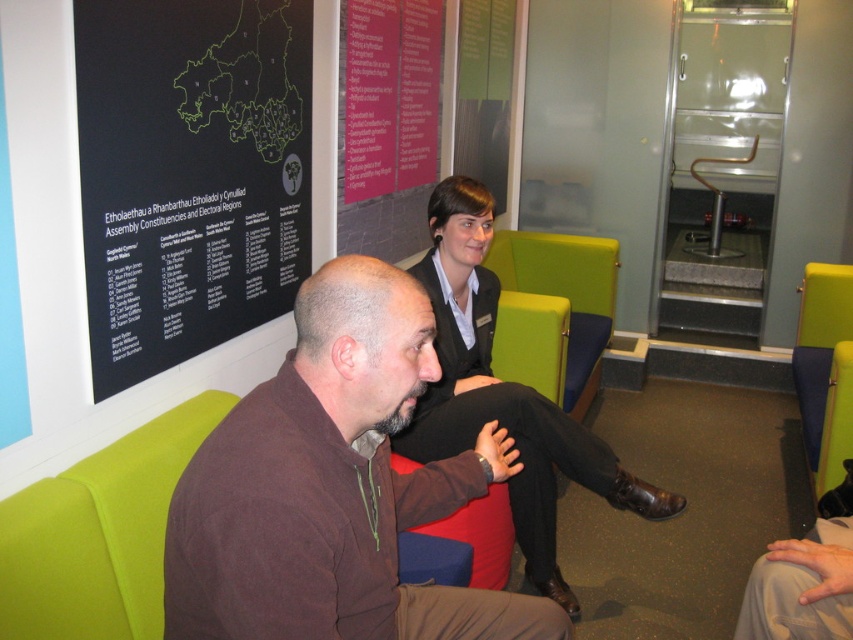
Question: Which object is farther from the camera taking this photo?

Choices:
 (A) black matte/blackboard at upper left
 (B) green fabric armchair at lower right

Answer: (B)

Question: Does brown cotton shirt at center appear over black matte/blackboard at upper left?

Choices:
 (A) no
 (B) yes

Answer: (A)

Question: Which point is closer to the camera?

Choices:
 (A) green fabric armchair at lower right
 (B) red fabric armchair at center
 (C) matte black blazer at center
 (D) brown cotton shirt at center

Answer: (D)

Question: Is black matte/blackboard at upper left above matte black blazer at center?

Choices:
 (A) yes
 (B) no

Answer: (A)

Question: In this image, where is black matte/blackboard at upper left located relative to green fabric armchair at lower right?

Choices:
 (A) left
 (B) right

Answer: (A)

Question: Which object is farther from the camera taking this photo?

Choices:
 (A) green fabric armchair at lower right
 (B) black matte/blackboard at upper left

Answer: (A)